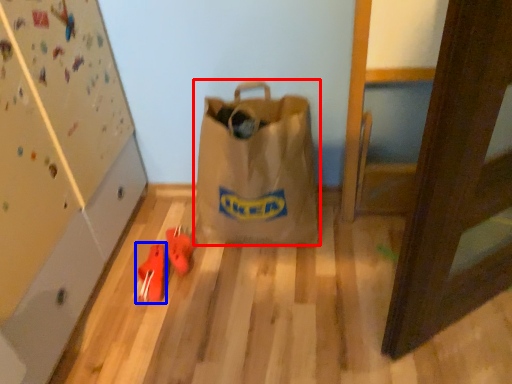
Question: Which object appears closest to the camera in this image, luggage and bags (highlighted by a red box) or footwear (highlighted by a blue box)?

Choices:
 (A) luggage and bags
 (B) footwear

Answer: (A)